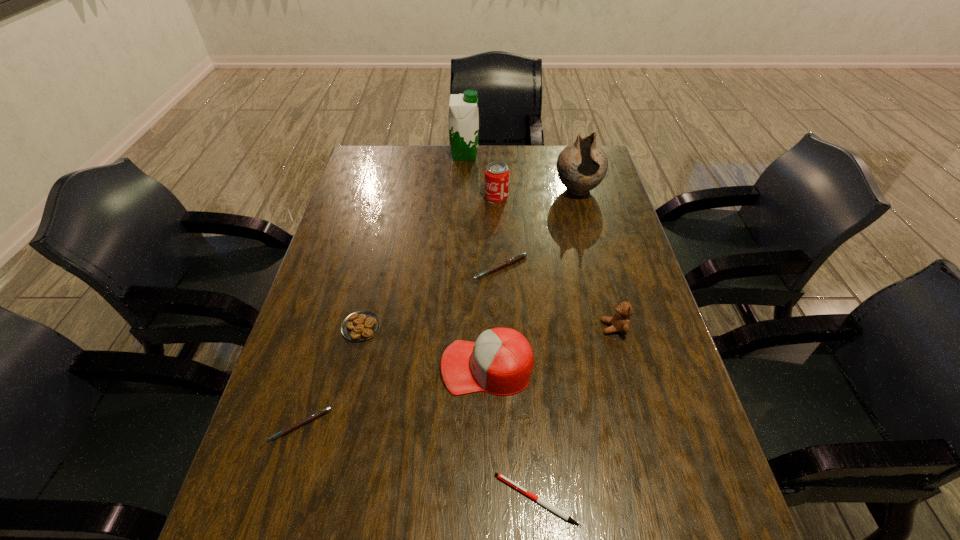
Identify the location of the farthest object. The image size is (960, 540). (463, 117).

I want to click on soya milk, so click(463, 117).

This screenshot has width=960, height=540. What are the coordinates of `pottery` in the screenshot? It's located at (581, 166).

Where is `can`? can is located at coordinates (496, 175).

At what (x,y) coordinates should I click in order to perform the action: click on red can. Please return your answer as a coordinate pair (x, y). The width and height of the screenshot is (960, 540). Looking at the image, I should click on (496, 175).

Locate an element on the screen. teddy bear is located at coordinates (620, 322).

Locate an element on the screen. red baseball cap is located at coordinates (500, 362).

Where is `pastry`? pastry is located at coordinates (359, 326).

You are a GUI agent. You are given a task and a screenshot of the screen. Output one action in this format:
    pyautogui.click(x=<x>, y=<y>)
    Task: Click on the sixth nearest object
    
    Given the screenshot: What is the action you would take?
    pyautogui.click(x=512, y=260)

Identify the location of the farther pink pen. (512, 260).